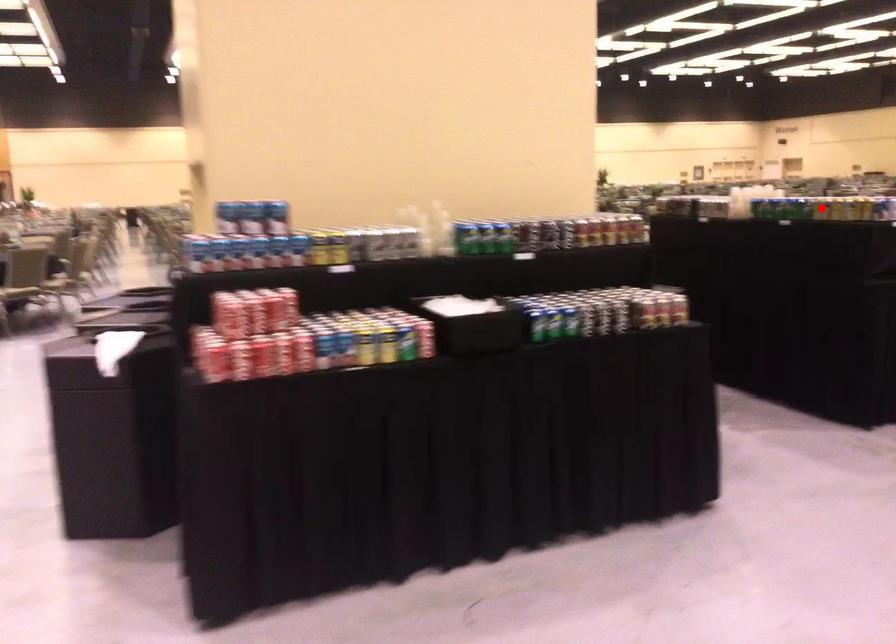
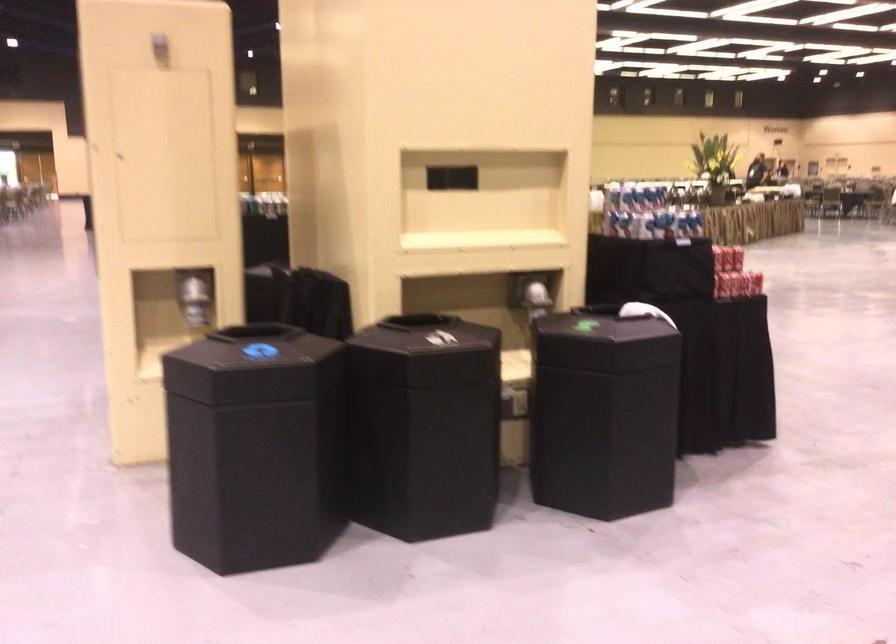
Question: I am providing you with two images of the same scene from different viewpoints. A red point is marked on the first image. Is the red point's position out of view in image 2?

Choices:
 (A) Yes
 (B) No

Answer: (A)